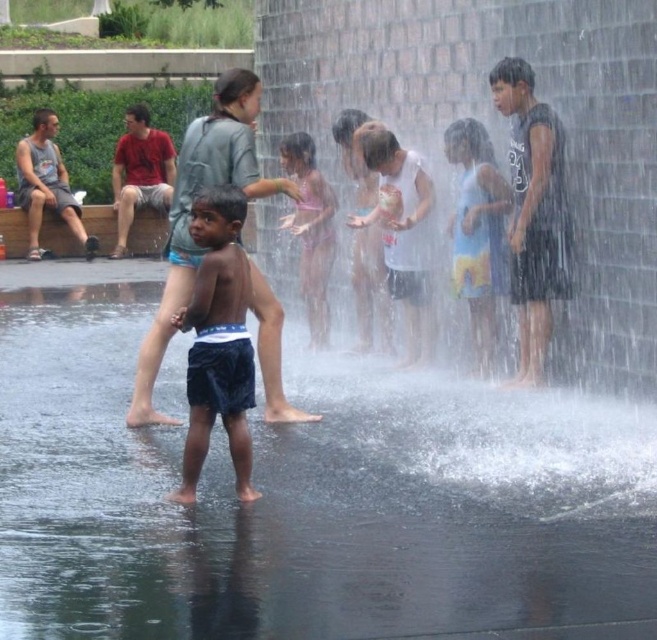
Can you confirm if white matte shirt at center is bigger than gray tank top at left?

No, white matte shirt at center is not bigger than gray tank top at left.

Identify the location of white matte shirt at center. This screenshot has width=657, height=640. (399, 227).

Identify the location of white matte shirt at center. (399, 227).

Does dark blue shorts at center have a lesser height compared to pink bikini at center?

Correct, dark blue shorts at center is not as tall as pink bikini at center.

Looking at this image, can you confirm if dark blue shorts at center is positioned below pink bikini at center?

Yes, dark blue shorts at center is below pink bikini at center.

Between point (237, 442) and point (306, 177), which one is positioned behind?

Positioned behind is point (306, 177).

I want to click on dark blue shorts at center, so click(217, 340).

Can you confirm if clear water at center is thinner than dark blue shorts at center?

No.

Can you confirm if clear water at center is shorter than dark blue shorts at center?

Indeed, clear water at center has a lesser height compared to dark blue shorts at center.

Is point (489, 600) farther from viewer compared to point (223, 397)?

No, it is not.

Where is `clear water at center`? This screenshot has width=657, height=640. clear water at center is located at coordinates (311, 500).